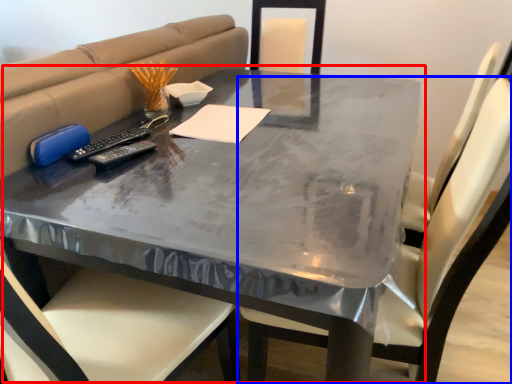
Question: Which object appears farthest to the camera in this image, table (highlighted by a red box) or chair (highlighted by a blue box)?

Choices:
 (A) table
 (B) chair

Answer: (A)